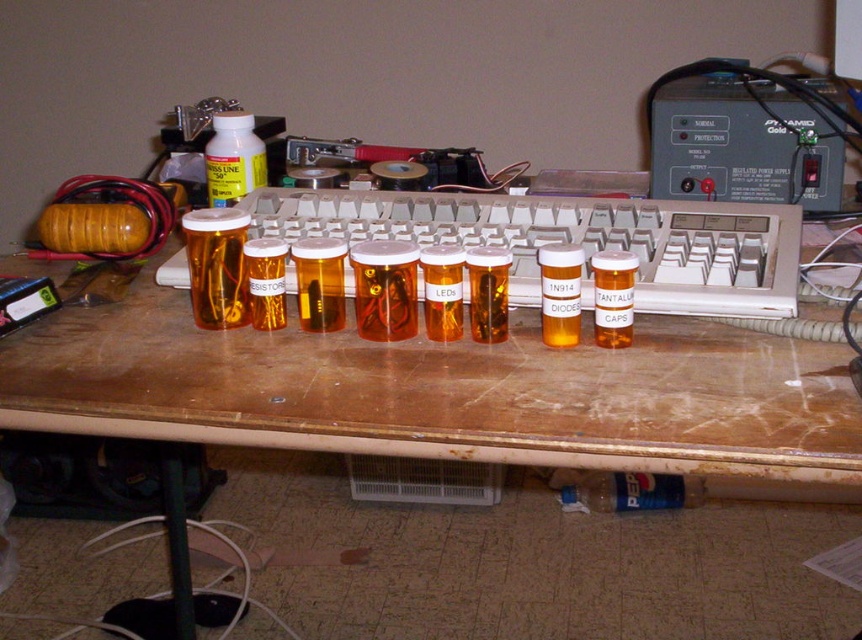
Can you confirm if translucent plastic computer desk at center is positioned to the right of yellow translucent bottle at center?

In fact, translucent plastic computer desk at center is to the left of yellow translucent bottle at center.

Does translucent plastic computer desk at center lie in front of yellow translucent bottle at center?

Yes.

Is point (822, 461) positioned before point (547, 323)?

Yes, point (822, 461) is closer to viewer.

Identify the location of translucent plastic computer desk at center. (464, 362).

Is point (579, 387) less distant than point (229, 225)?

Yes, point (579, 387) is in front of point (229, 225).

Can you confirm if translucent plastic computer desk at center is shorter than gold plastic pill bottles at center?

In fact, translucent plastic computer desk at center may be taller than gold plastic pill bottles at center.

Is point (772, 362) positioned in front of point (232, 289)?

Yes, it is.

Where is `translucent plastic computer desk at center`? This screenshot has height=640, width=862. translucent plastic computer desk at center is located at coordinates (464, 362).

Can you confirm if gold plastic pill bottles at center is smaller than white plastic bottle at center?

Yes, gold plastic pill bottles at center is smaller than white plastic bottle at center.

Is gold plastic pill bottles at center behind white plastic bottle at center?

That is False.

Who is more distant from viewer, (241, 227) or (253, 125)?

Positioned behind is point (253, 125).

Where is `gold plastic pill bottles at center`? The image size is (862, 640). gold plastic pill bottles at center is located at coordinates (216, 266).